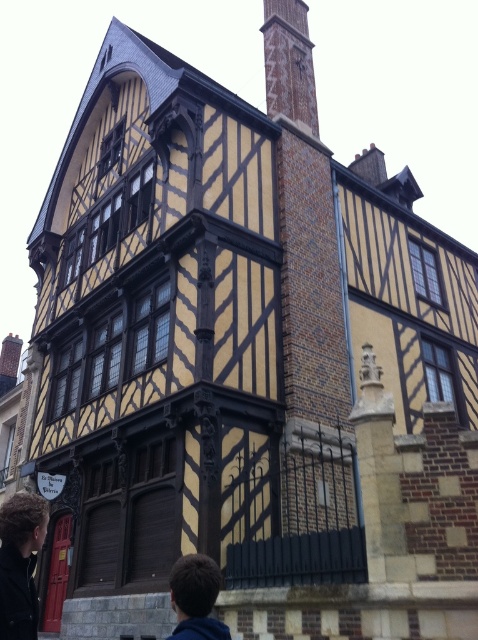
You are a GUI agent. You are given a task and a screenshot of the screen. Output one action in this format:
    pyautogui.click(x=<x>, y=<y>)
    Task: Click on the brick chimney at upper center
    The image size is (478, 640).
    Given the screenshot: What is the action you would take?
    pyautogui.click(x=289, y=64)

Between point (265, 106) and point (12, 621), which one is positioned behind?

The point (265, 106) is behind.

Is point (311, 120) positioned before point (0, 563)?

No.

You are a GUI agent. You are given a task and a screenshot of the screen. Output one action in this format:
    pyautogui.click(x=<x>, y=<y>)
    Task: Click on the brick chimney at upper center
    This screenshot has width=478, height=640.
    Given the screenshot: What is the action you would take?
    pyautogui.click(x=289, y=64)

Find the location of a particular element. The width and height of the screenshot is (478, 640). dark brown hair at lower left is located at coordinates (20, 563).

At what (x,y) coordinates should I click in order to perform the action: click on dark brown hair at lower left. Please return your answer as a coordinate pair (x, y). Image resolution: width=478 pixels, height=640 pixels. Looking at the image, I should click on (20, 563).

Does brick chimney at upper center come behind brown hair at lower center?

Yes, it is behind brown hair at lower center.

Which is behind, point (294, 88) or point (208, 570)?

Positioned behind is point (294, 88).

Image resolution: width=478 pixels, height=640 pixels. What do you see at coordinates (289, 64) in the screenshot? I see `brick chimney at upper center` at bounding box center [289, 64].

Find the location of a particular element. This screenshot has height=640, width=478. brick chimney at upper center is located at coordinates (289, 64).